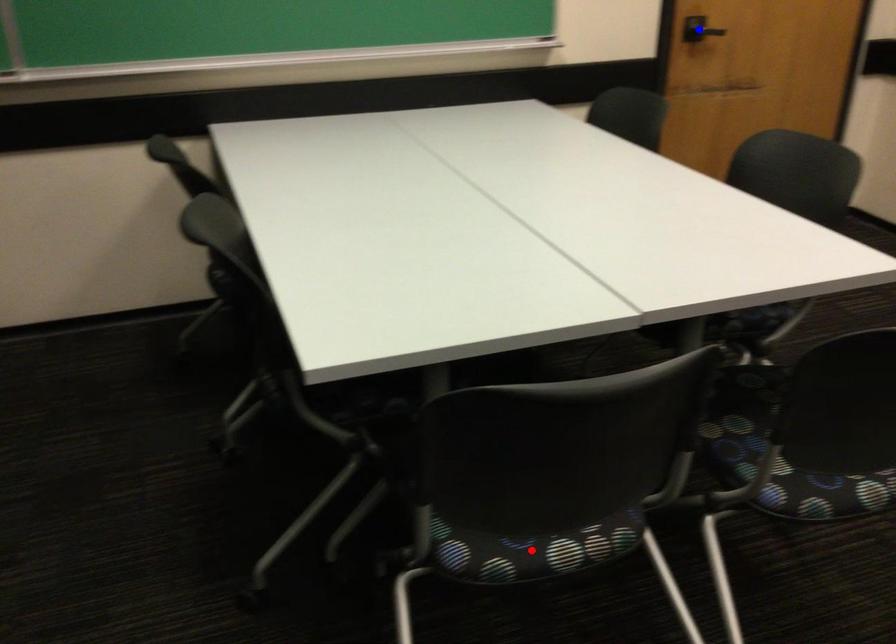
Question: Which of the two points in the image is closer to the camera?

Choices:
 (A) Blue point is closer.
 (B) Red point is closer.

Answer: (B)